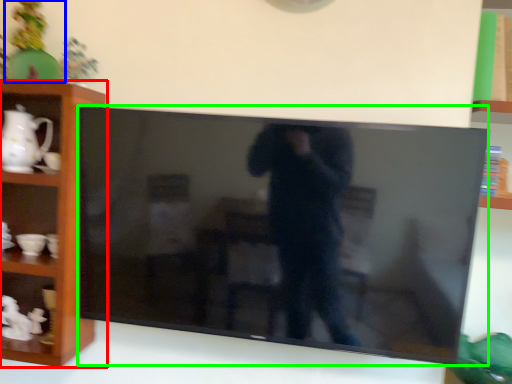
Question: Which is farther away from shelf (highlighted by a red box)? toy (highlighted by a blue box) or television (highlighted by a green box)?

Choices:
 (A) toy
 (B) television

Answer: (B)